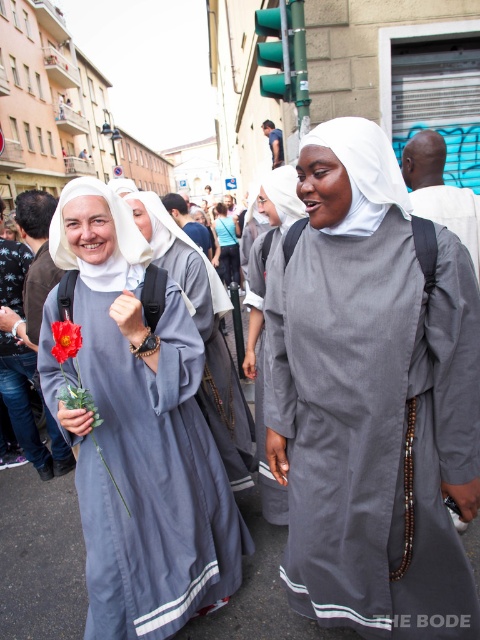
You are a pedestrian standing at the point with coordinates point (228, 240). You want to walk to the point with coordinates point (226, 371). Which direction should you move in relation to the two points?

Point (226, 371) is in front of point 0.375, 0.377, so you should move forward towards point (226, 371).

You are a photographer trying to capture a clear shot of both the matte gray robe at center and the light blue fabric dress at center. Which one is closer to the camera?

The matte gray robe at center is in front of the light blue fabric dress at center, so the matte gray robe at center is closer to the camera.